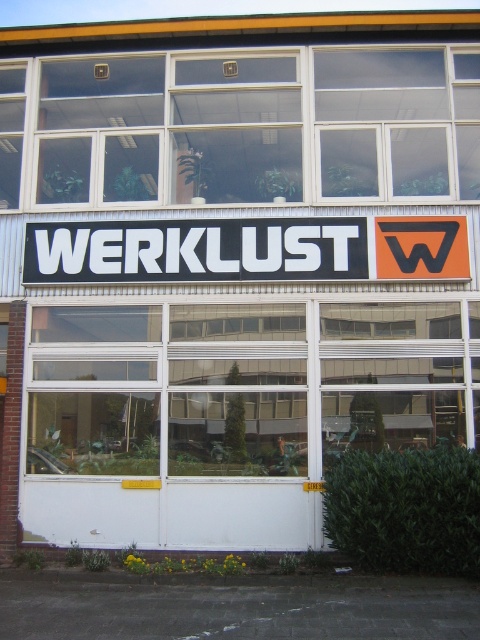
You are a window cleaner who needs to clean the clear glass window at center and the black plastic sign at center. Which object requires a larger cleaning area?

The clear glass window at center requires a larger cleaning area because it is larger in size than the black plastic sign at center.

You are standing in front of the commercial building and want to see the black plastic sign at center clearly. Can you look through the clear glass window at center to see it?

The black plastic sign at center is behind the clear glass window at center, so yes, you can look through the clear glass window at center to see the black plastic sign at center.

You are a window installer assessing the building. You need to replace the clear glass window at center and the black plastic sign at center. Which object requires a taller replacement based on their current dimensions?

The clear glass window at center has a greater height compared to the black plastic sign at center, so the replacement for the clear glass window at center needs to be taller.